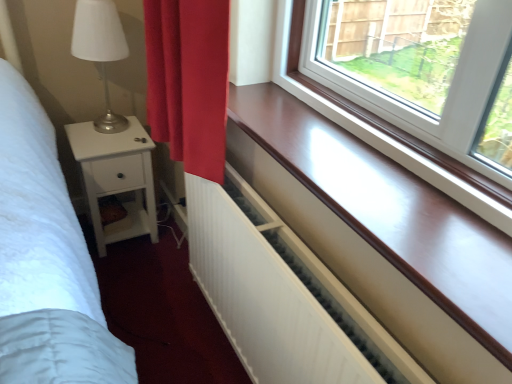
Question: Does white wood nightstand at left appear on the left side of smooth wood window sill at center?

Choices:
 (A) no
 (B) yes

Answer: (B)

Question: From the image's perspective, is white wood nightstand at left under smooth wood window sill at center?

Choices:
 (A) no
 (B) yes

Answer: (B)

Question: From the image's perspective, is white wood nightstand at left located above smooth wood window sill at center?

Choices:
 (A) yes
 (B) no

Answer: (B)

Question: Can you confirm if white wood nightstand at left is bigger than smooth wood window sill at center?

Choices:
 (A) no
 (B) yes

Answer: (B)

Question: Is white wood nightstand at left completely or partially outside of smooth wood window sill at center?

Choices:
 (A) yes
 (B) no

Answer: (A)

Question: Is white wood nightstand at left in front of smooth wood window sill at center?

Choices:
 (A) no
 (B) yes

Answer: (A)

Question: Would you say white matte radiator at lower center contains smooth wood window sill at center?

Choices:
 (A) yes
 (B) no

Answer: (B)

Question: Is white matte radiator at lower center wider than smooth wood window sill at center?

Choices:
 (A) yes
 (B) no

Answer: (B)

Question: Is white matte radiator at lower center outside smooth wood window sill at center?

Choices:
 (A) yes
 (B) no

Answer: (A)

Question: Does white matte radiator at lower center have a lesser width compared to smooth wood window sill at center?

Choices:
 (A) yes
 (B) no

Answer: (A)

Question: Considering the relative positions of white matte radiator at lower center and smooth wood window sill at center in the image provided, is white matte radiator at lower center to the right of smooth wood window sill at center from the viewer's perspective?

Choices:
 (A) yes
 (B) no

Answer: (B)

Question: From a real-world perspective, is white matte radiator at lower center below smooth wood window sill at center?

Choices:
 (A) yes
 (B) no

Answer: (A)

Question: From a real-world perspective, is smooth wood window sill at center located higher than white matte radiator at lower center?

Choices:
 (A) yes
 (B) no

Answer: (A)